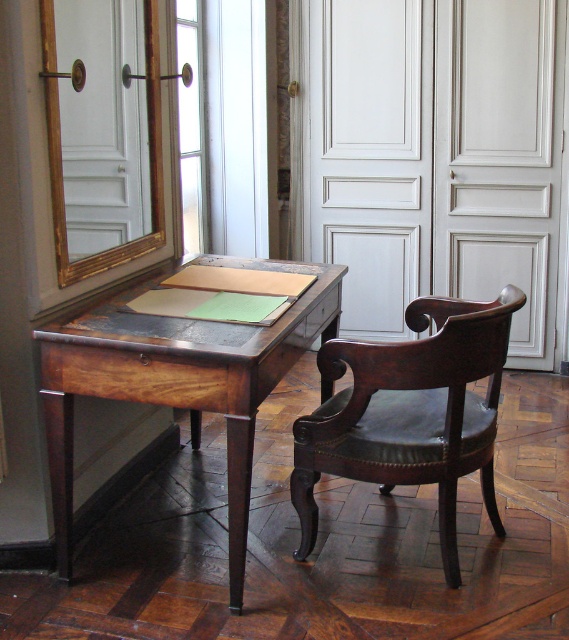
Question: Is mahogany wood desk at center below mahogany leather armchair at center?

Choices:
 (A) no
 (B) yes

Answer: (A)

Question: Can you confirm if mahogany wood desk at center is positioned above mahogany leather armchair at center?

Choices:
 (A) no
 (B) yes

Answer: (B)

Question: Can you confirm if mahogany wood desk at center is positioned to the left of mahogany leather armchair at center?

Choices:
 (A) yes
 (B) no

Answer: (A)

Question: Which point appears closest to the camera in this image?

Choices:
 (A) (319, 416)
 (B) (336, 280)

Answer: (A)

Question: Which object is closer to the camera taking this photo?

Choices:
 (A) mahogany wood desk at center
 (B) mahogany leather armchair at center

Answer: (A)